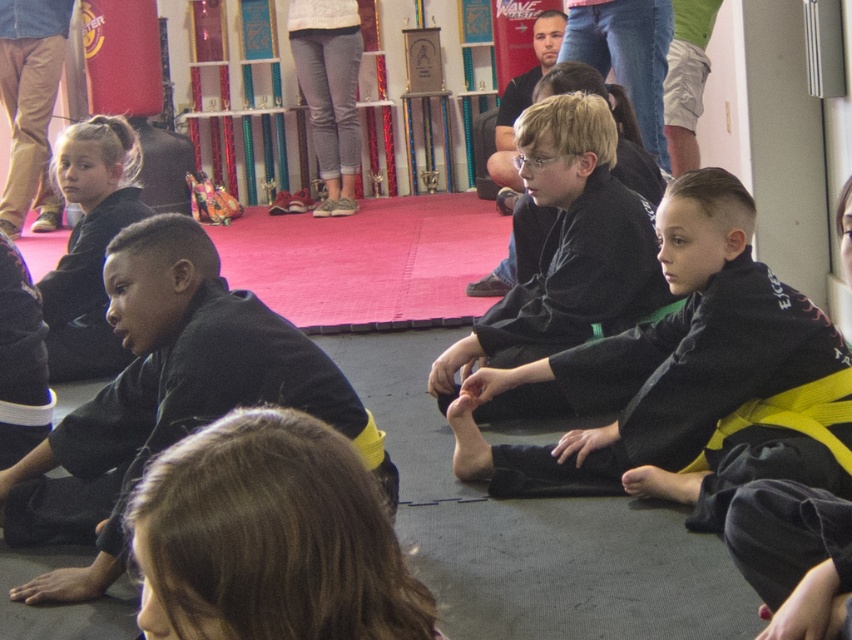
Who is positioned more to the right, black matte karate gi at center or matte black karate gi at left?

black matte karate gi at center is more to the right.

Is black matte karate gi at center positioned in front of matte black karate gi at left?

Yes, black matte karate gi at center is in front of matte black karate gi at left.

Measure the distance between black matte karate gi at center and camera.

3.24 meters

This screenshot has width=852, height=640. I want to click on black matte karate gi at center, so [x=567, y=248].

Is black matte karate gi at left to the left of brown hair at lower center from the viewer's perspective?

Yes, black matte karate gi at left is to the left of brown hair at lower center.

Who is more forward, (289, 394) or (174, 621)?

Point (174, 621)

Locate an element on the screen. The width and height of the screenshot is (852, 640). black matte karate gi at left is located at coordinates (167, 397).

Does point (424, 621) come behind point (540, 326)?

No, it is in front of (540, 326).

Is point (370, 518) less distant than point (557, 122)?

Yes.

Is point (295, 614) less distant than point (585, 224)?

Yes.

Where is `brown hair at lower center`? This screenshot has height=640, width=852. brown hair at lower center is located at coordinates (269, 538).